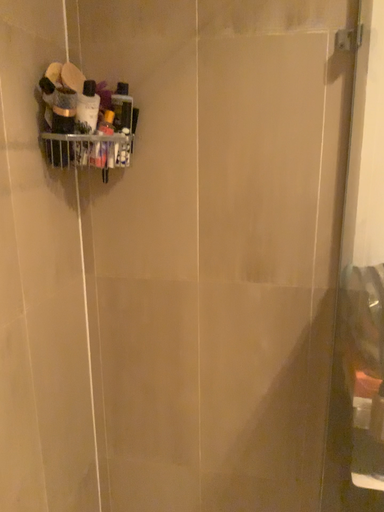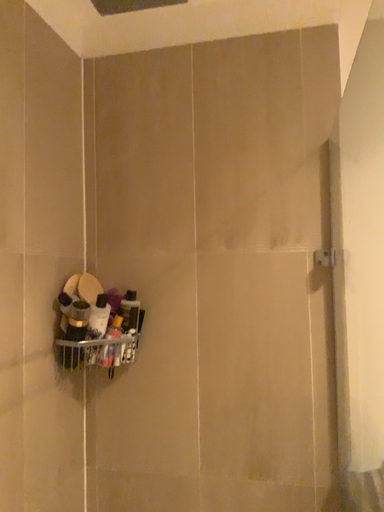
Question: Which way did the camera rotate in the video?

Choices:
 (A) rotated upward
 (B) rotated downward

Answer: (A)